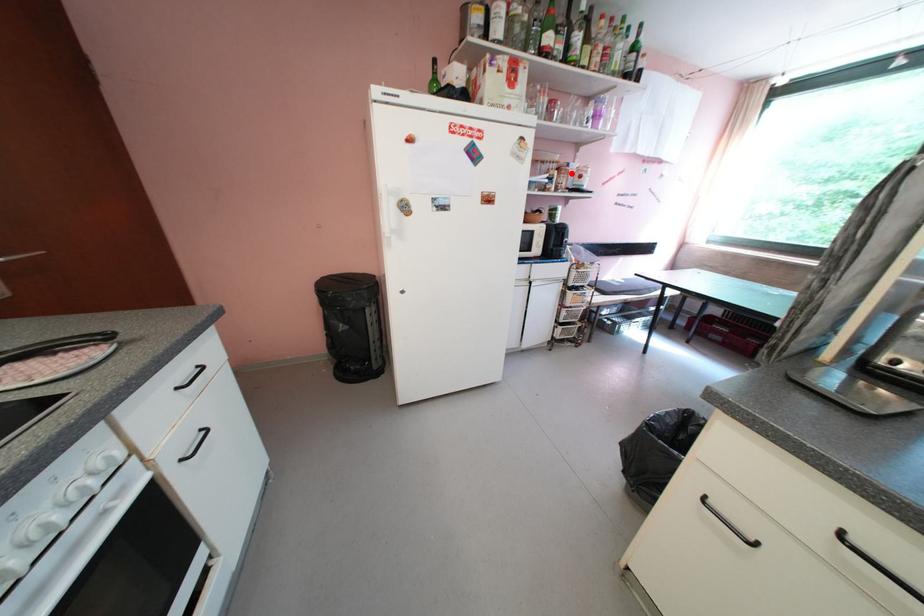
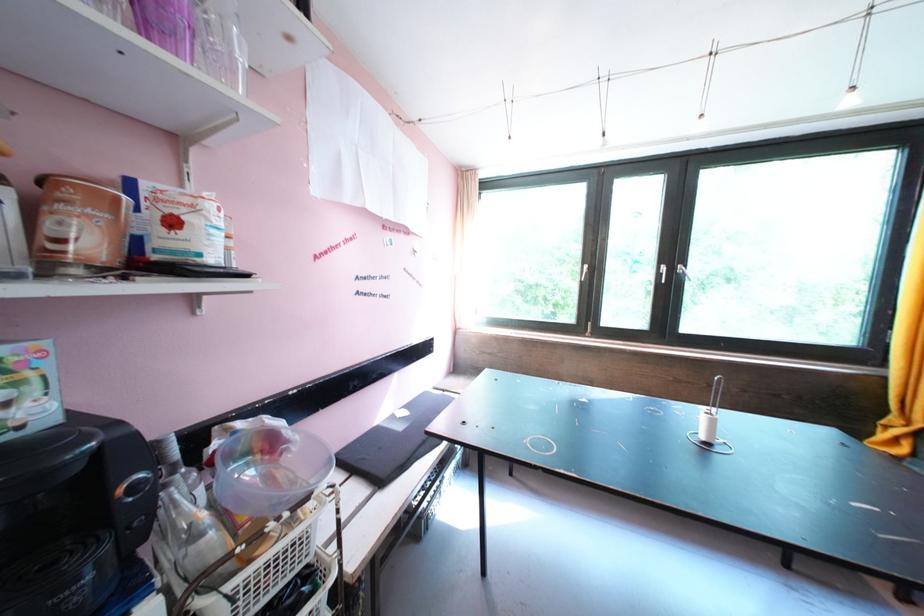
Where in the second image is the point corresponding to the highlighted location from the first image?

(78, 196)